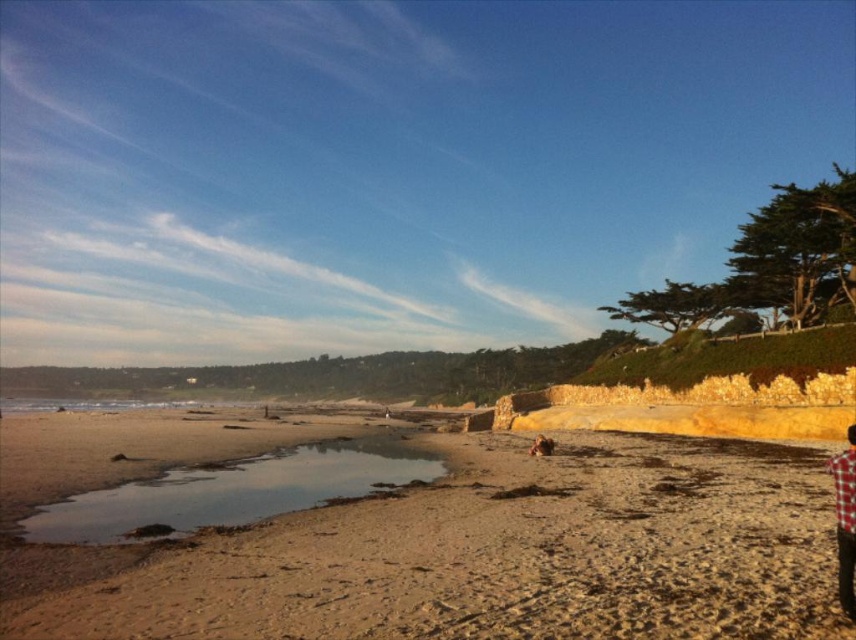
Is brown sandy beach at lower left bigger than plaid fabric shirt at lower right?

Correct, brown sandy beach at lower left is larger in size than plaid fabric shirt at lower right.

Does brown sandy beach at lower left have a greater width compared to plaid fabric shirt at lower right?

Correct, the width of brown sandy beach at lower left exceeds that of plaid fabric shirt at lower right.

Does point (794, 522) lie behind point (849, 584)?

Yes, it is.

Locate an element on the screen. brown sandy beach at lower left is located at coordinates (480, 556).

Does plaid fabric shirt at lower right appear over brown fur dog at center?

Correct, plaid fabric shirt at lower right is located above brown fur dog at center.

Which of these two, plaid fabric shirt at lower right or brown fur dog at center, stands taller?

plaid fabric shirt at lower right

Locate an element on the screen. plaid fabric shirt at lower right is located at coordinates (845, 520).

Find the location of a particular element. plaid fabric shirt at lower right is located at coordinates (845, 520).

Looking at this image, does brown sandy beach at lower left have a larger size compared to brown fur dog at center?

Yes.

Which is in front, point (632, 476) or point (545, 436)?

Positioned in front is point (632, 476).

At what (x,y) coordinates should I click in order to perform the action: click on brown sandy beach at lower left. Please return your answer as a coordinate pair (x, y). Looking at the image, I should click on (480, 556).